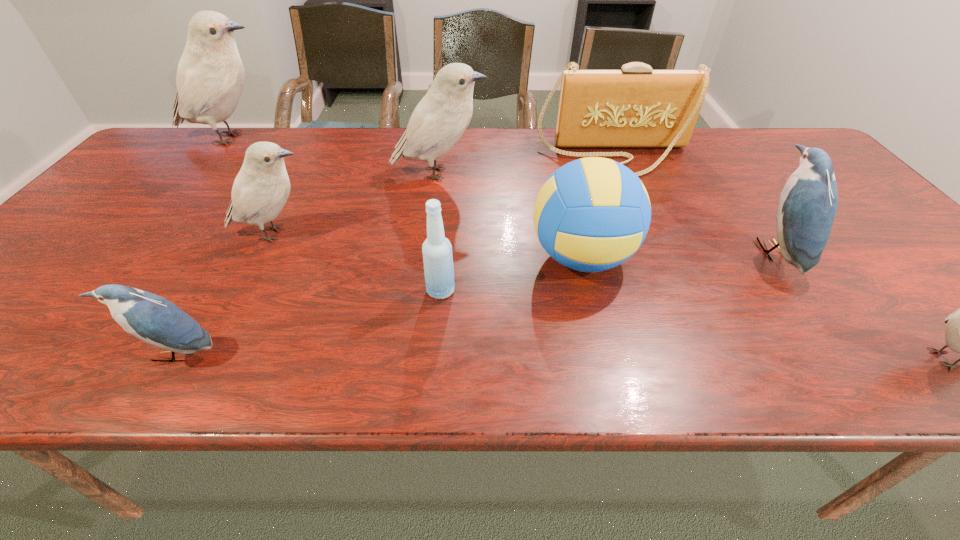
Where is `free space located on the right of the volleyball`? This screenshot has height=540, width=960. free space located on the right of the volleyball is located at coordinates (761, 257).

You are a GUI agent. You are given a task and a screenshot of the screen. Output one action in this format:
    pyautogui.click(x=<x>, y=<y>)
    Task: Click on the vacant space located 0.180m on the right of the bottle
    The width and height of the screenshot is (960, 540).
    Given the screenshot: What is the action you would take?
    pyautogui.click(x=540, y=291)

At what (x,y) coordinates should I click in order to perform the action: click on handbag that is at the far edge. Please return your answer as a coordinate pair (x, y). Looking at the image, I should click on (636, 106).

At what (x,y) coordinates should I click in order to perform the action: click on object that is at the near edge. Please return your answer as a coordinate pair (x, y). The height and width of the screenshot is (540, 960). Looking at the image, I should click on pyautogui.click(x=153, y=319).

In order to click on object that is at the left edge in this screenshot , I will do `click(210, 78)`.

Where is `object that is at the far left corner`? object that is at the far left corner is located at coordinates (210, 78).

The image size is (960, 540). In order to click on free region at the far edge in this screenshot , I will do `click(243, 130)`.

You are a GUI agent. You are given a task and a screenshot of the screen. Output one action in this format:
    pyautogui.click(x=<x>, y=<y>)
    Task: Click on the free space at the near edge
    This screenshot has width=960, height=540.
    Given the screenshot: What is the action you would take?
    pyautogui.click(x=717, y=356)

You are a GUI agent. You are given a task and a screenshot of the screen. Output one action in this format:
    pyautogui.click(x=<x>, y=<y>)
    Task: Click on the vacant space at the left edge of the desktop
    Image resolution: width=960 pixels, height=540 pixels.
    Given the screenshot: What is the action you would take?
    pyautogui.click(x=47, y=268)

This screenshot has height=540, width=960. In the image, there is a desktop. Find the location of `vacant space at the right edge`. vacant space at the right edge is located at coordinates (925, 330).